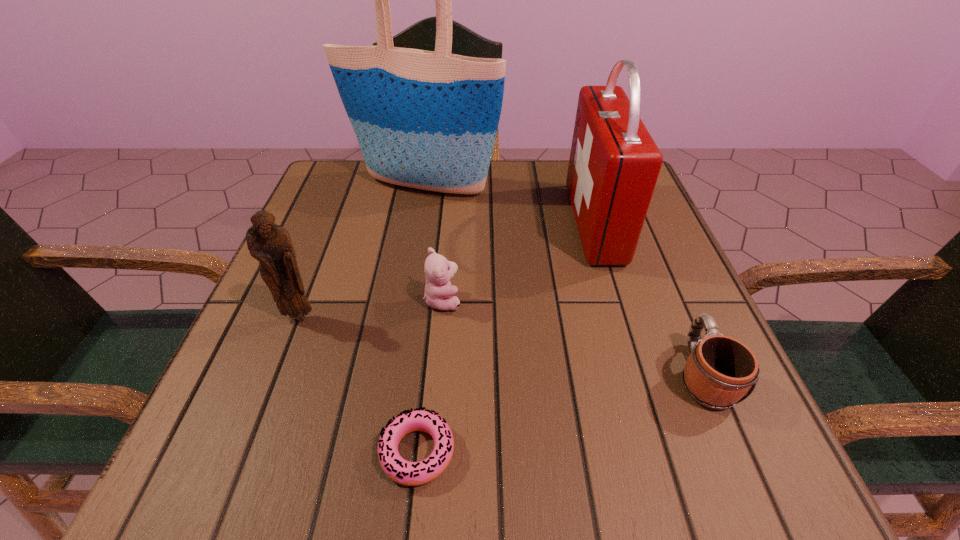
The width and height of the screenshot is (960, 540). In order to click on the first-aid kit that is at the far edge in this screenshot , I will do `click(614, 164)`.

This screenshot has width=960, height=540. Identify the location of object located at the near edge. (404, 472).

The width and height of the screenshot is (960, 540). I want to click on tote bag present at the left edge, so click(x=428, y=120).

Find the location of a particular element. figurine at the left edge is located at coordinates (270, 244).

Locate an element on the screen. This screenshot has height=540, width=960. the first-aid kit that is positioned at the right edge is located at coordinates (614, 164).

Image resolution: width=960 pixels, height=540 pixels. I want to click on mug that is at the right edge, so click(719, 372).

At what (x,y) coordinates should I click in order to perform the action: click on object that is at the far left corner. Please return your answer as a coordinate pair (x, y). Looking at the image, I should click on (428, 120).

I want to click on object that is positioned at the far right corner, so click(614, 164).

Find the location of a particular element. The image size is (960, 540). free location at the far edge is located at coordinates point(541,193).

The image size is (960, 540). In order to click on free region at the near edge in this screenshot , I will do `click(494, 480)`.